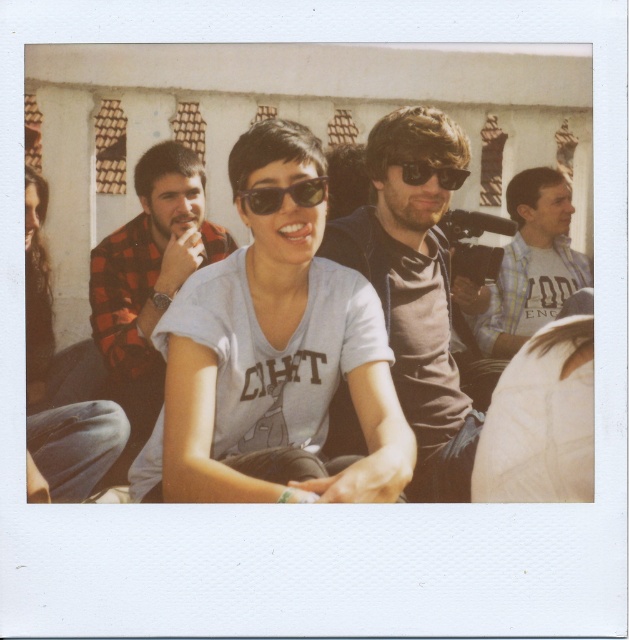
Between point (291, 161) and point (314, 198), which one is positioned behind?

The point (314, 198) is behind.

What do you see at coordinates (272, 353) in the screenshot? I see `white matte shirt at center` at bounding box center [272, 353].

I want to click on white matte shirt at center, so click(x=272, y=353).

Locate an element on the screen. This screenshot has height=640, width=629. white matte shirt at center is located at coordinates (272, 353).

The height and width of the screenshot is (640, 629). What do you see at coordinates (415, 291) in the screenshot?
I see `matte brown shirt at center` at bounding box center [415, 291].

Is matte brown shirt at center behind flannel shirt at center?

No, it is not.

Who is more distant from viewer, (479, 419) or (152, 259)?

Positioned behind is point (152, 259).

I want to click on matte brown shirt at center, so click(x=415, y=291).

What do you see at coordinates (415, 291) in the screenshot?
I see `matte brown shirt at center` at bounding box center [415, 291].

Describe the element at coordinates (415, 291) in the screenshot. The image size is (629, 640). I see `matte brown shirt at center` at that location.

Locate an element on the screen. This screenshot has height=640, width=629. matte brown shirt at center is located at coordinates (415, 291).